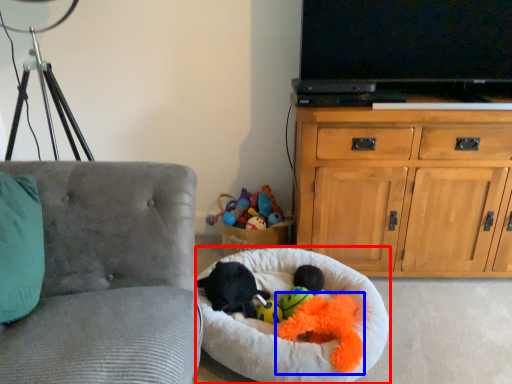
Question: Among these objects, which one is farthest to the camera, dog bed (highlighted by a red box) or toy (highlighted by a blue box)?

Choices:
 (A) dog bed
 (B) toy

Answer: (B)